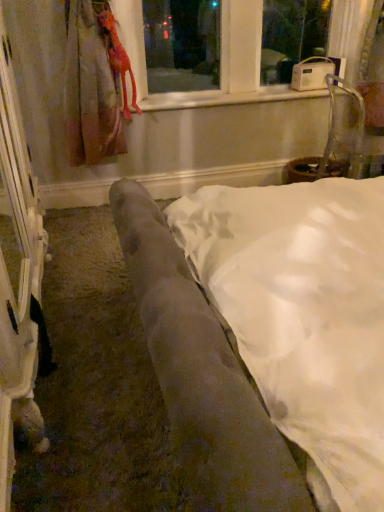
I want to click on white plastic radio at upper center, so click(x=228, y=51).

The image size is (384, 512). Describe the element at coordinates (119, 60) in the screenshot. I see `rubber duck at upper left` at that location.

Where is `velvet gray couch at center`? This screenshot has height=512, width=384. velvet gray couch at center is located at coordinates (202, 374).

Describe the element at coordinates (202, 374) in the screenshot. I see `velvet gray couch at center` at that location.

Where is `white plastic radio at upper center`? This screenshot has height=512, width=384. white plastic radio at upper center is located at coordinates (228, 51).

Which object is further away from the camera, velvet gray couch at center or white plastic radio at upper center?

white plastic radio at upper center is further from the camera.

Considering the sizes of velvet gray couch at center and white plastic radio at upper center in the image, is velvet gray couch at center wider or thinner than white plastic radio at upper center?

Considering their sizes, velvet gray couch at center looks broader than white plastic radio at upper center.

Which of these two, velvet gray couch at center or white plastic radio at upper center, stands taller?

With more height is white plastic radio at upper center.

Identify the location of bay window behind the velvet gray couch at center. click(228, 51).

In terms of height, does white plastic radio at upper center look taller or shorter compared to velvet gray couch at center?

Clearly, white plastic radio at upper center is taller compared to velvet gray couch at center.

Between white plastic radio at upper center and velvet gray couch at center, which one has smaller size?

With smaller size is white plastic radio at upper center.

How distant is white plastic radio at upper center from velvet gray couch at center?

white plastic radio at upper center is 6.09 feet away from velvet gray couch at center.

Could you tell me if white plastic radio at upper center is turned towards velvet gray couch at center?

No, white plastic radio at upper center is not oriented towards velvet gray couch at center.

Considering the positions of objects white plastic radio at upper center and rubber duck at upper left in the image provided, who is more to the right, white plastic radio at upper center or rubber duck at upper left?

Positioned to the right is white plastic radio at upper center.

Looking at this image, is white plastic radio at upper center smaller than rubber duck at upper left?

Actually, white plastic radio at upper center might be larger than rubber duck at upper left.

What's the angular difference between velvet gray couch at center and rubber duck at upper left's facing directions?

There is a 89.2-degree angle between the facing directions of velvet gray couch at center and rubber duck at upper left.

Identify the location of animal above the velvet gray couch at center (from the image's perspective). The width and height of the screenshot is (384, 512). (119, 60).

Is velvet gray couch at center placed right next to rubber duck at upper left?

They are not placed beside each other.

Is velvet gray couch at center looking in the opposite direction of rubber duck at upper left?

No, velvet gray couch at center's orientation is not away from rubber duck at upper left.

Between rubber duck at upper left and velvet gray couch at center, which one is positioned behind?

rubber duck at upper left.

Is rubber duck at upper left far from velvet gray couch at center?

Yes, rubber duck at upper left and velvet gray couch at center are located far from each other.

In the scene shown: In terms of width, does rubber duck at upper left look wider or thinner when compared to velvet gray couch at center?

In the image, rubber duck at upper left appears to be more narrow than velvet gray couch at center.

Looking at this image, which point is more forward, (122, 70) or (135, 212)?

Point (135, 212)

From a real-world perspective, is rubber duck at upper left positioned above or below white plastic radio at upper center?

rubber duck at upper left is below white plastic radio at upper center.

Considering the points (115, 24) and (274, 51), which point is behind, point (115, 24) or point (274, 51)?

Positioned behind is point (274, 51).

From the image's perspective, which one is positioned higher, rubber duck at upper left or white plastic radio at upper center?

white plastic radio at upper center.

Identify the location of bay window located above the velvet gray couch at center (from a real-world perspective). (228, 51).

Find the location of `furniture that is on the right side of white plastic radio at upper center`. furniture that is on the right side of white plastic radio at upper center is located at coordinates (202, 374).

When comparing their distances from white plastic radio at upper center, does rubber duck at upper left or velvet gray couch at center seem further?

velvet gray couch at center lies further to white plastic radio at upper center than the other object.

When comparing their distances from rubber duck at upper left, does white plastic radio at upper center or velvet gray couch at center seem closer?

The object closer to rubber duck at upper left is white plastic radio at upper center.

Based on their spatial positions, is velvet gray couch at center or rubber duck at upper left further from white plastic radio at upper center?

Among the two, velvet gray couch at center is located further to white plastic radio at upper center.

Estimate the real-world distances between objects in this image. Which object is further from velvet gray couch at center, rubber duck at upper left or white plastic radio at upper center?

The object further to velvet gray couch at center is white plastic radio at upper center.

Considering their positions, is velvet gray couch at center positioned closer to rubber duck at upper left than white plastic radio at upper center?

white plastic radio at upper center.

In the scene shown: Which object lies nearer to the anchor point velvet gray couch at center, white plastic radio at upper center or rubber duck at upper left?

The object closer to velvet gray couch at center is rubber duck at upper left.

Find the location of a particular element. Image resolution: width=384 pixels, height=512 pixels. animal between velvet gray couch at center and white plastic radio at upper center from front to back is located at coordinates (119, 60).